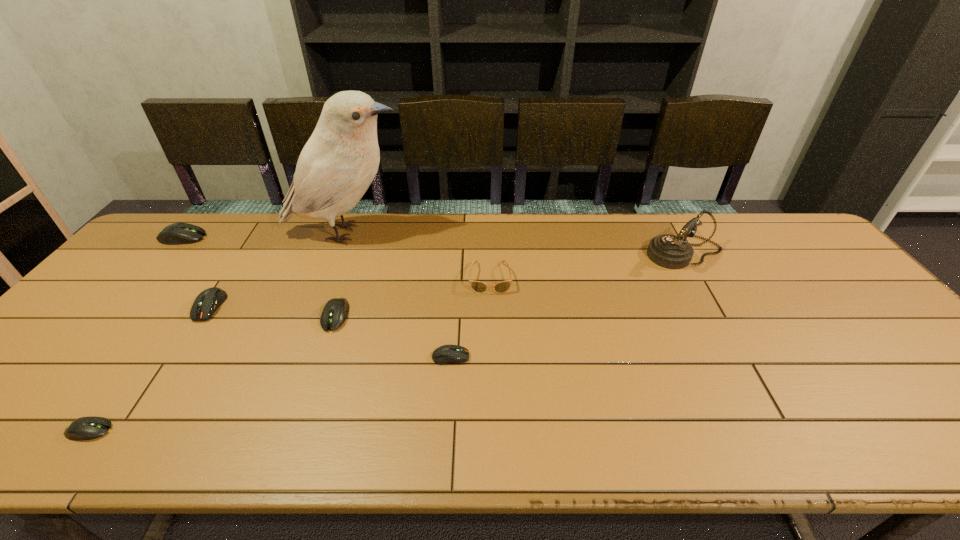
In the image, there is a desktop. At what (x,y) coordinates should I click in order to perform the action: click on free space at the near edge. Please return your answer as a coordinate pair (x, y). Image resolution: width=960 pixels, height=540 pixels. Looking at the image, I should click on (846, 436).

In the image, there is a desktop. Find the location of `vacant space at the left edge`. vacant space at the left edge is located at coordinates (101, 324).

You are a GUI agent. You are given a task and a screenshot of the screen. Output one action in this format:
    pyautogui.click(x=<x>, y=<y>)
    Task: Click on the vacant space at the right edge
    This screenshot has width=960, height=540.
    Given the screenshot: What is the action you would take?
    pyautogui.click(x=826, y=278)

In the image, there is a desktop. Where is `free space at the far right corner`? The image size is (960, 540). free space at the far right corner is located at coordinates (804, 238).

Locate an element on the screen. The height and width of the screenshot is (540, 960). free area in between the white parakeet and the second tallest object is located at coordinates (516, 244).

You are a GUI agent. You are given a task and a screenshot of the screen. Output one action in this format:
    pyautogui.click(x=<x>, y=<y>)
    Task: Click on the free space between the telephone and the smallest gray computer mouse
    The height and width of the screenshot is (540, 960).
    Given the screenshot: What is the action you would take?
    pyautogui.click(x=388, y=342)

Identify the location of free spot between the leftmost computer mouse and the third computer mouse from left to right. Image resolution: width=960 pixels, height=540 pixels. (197, 272).

Where is `unoccupied position between the second tallest object and the rightmost computer mouse`? The image size is (960, 540). unoccupied position between the second tallest object and the rightmost computer mouse is located at coordinates (568, 305).

The width and height of the screenshot is (960, 540). I want to click on free space between the smallest gray computer mouse and the parakeet, so click(x=218, y=332).

In order to click on free space between the telephone and the second nearest object in this screenshot , I will do `click(568, 305)`.